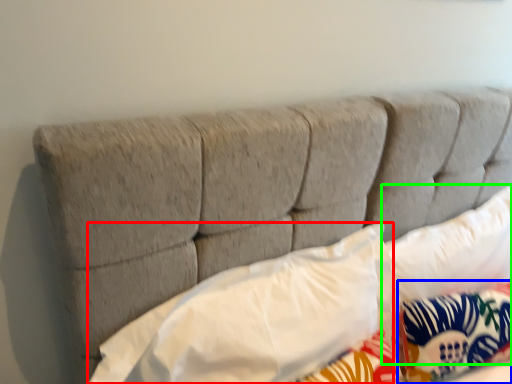
Question: Which object is the farthest from pillow (highlighted by a red box)? Choose among these: pillow (highlighted by a blue box) or pillow (highlighted by a green box).

Choices:
 (A) pillow
 (B) pillow

Answer: (B)